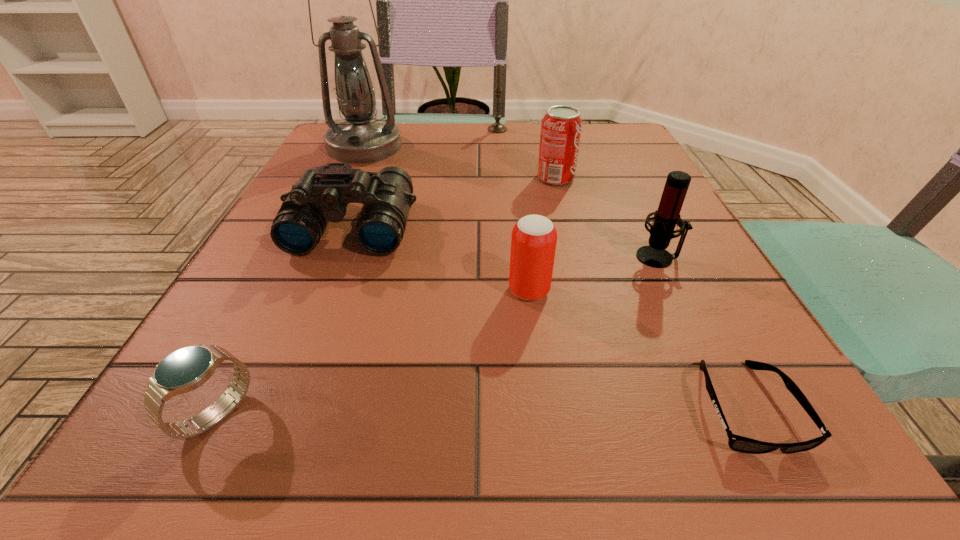
Where is `free space located 0.280m on the left of the candle`? The image size is (960, 540). free space located 0.280m on the left of the candle is located at coordinates (377, 130).

The width and height of the screenshot is (960, 540). In order to click on vacant space situated 0.240m on the left of the microphone in this screenshot , I will do `click(492, 257)`.

I want to click on free space located 0.340m on the front of the third object from right to left, so click(588, 305).

In order to click on free space located 0.190m through the lenses of the binoculars in this screenshot , I will do `click(306, 347)`.

Locate an element on the screen. Image resolution: width=960 pixels, height=540 pixels. free location located on the left of the third nearest object is located at coordinates (264, 291).

You are a GUI agent. You are given a task and a screenshot of the screen. Output one action in this format:
    pyautogui.click(x=<x>, y=<y>)
    Task: Click on the free spot located on the back of the seventh tallest object
    The image size is (960, 540).
    Given the screenshot: What is the action you would take?
    pyautogui.click(x=278, y=292)

What are the coordinates of `oil lamp positioned at the far edge` in the screenshot? It's located at (360, 139).

The height and width of the screenshot is (540, 960). In order to click on candle at the far edge in this screenshot , I will do click(497, 127).

The width and height of the screenshot is (960, 540). I want to click on watch positioned at the near edge, so click(x=184, y=370).

The width and height of the screenshot is (960, 540). I want to click on sunglasses present at the near edge, so click(737, 443).